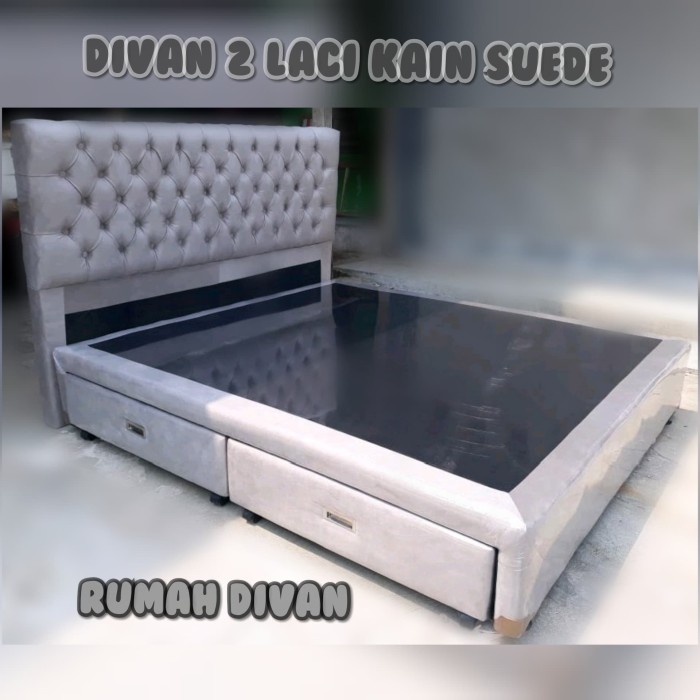
Identify the location of white carpet. (645, 503).